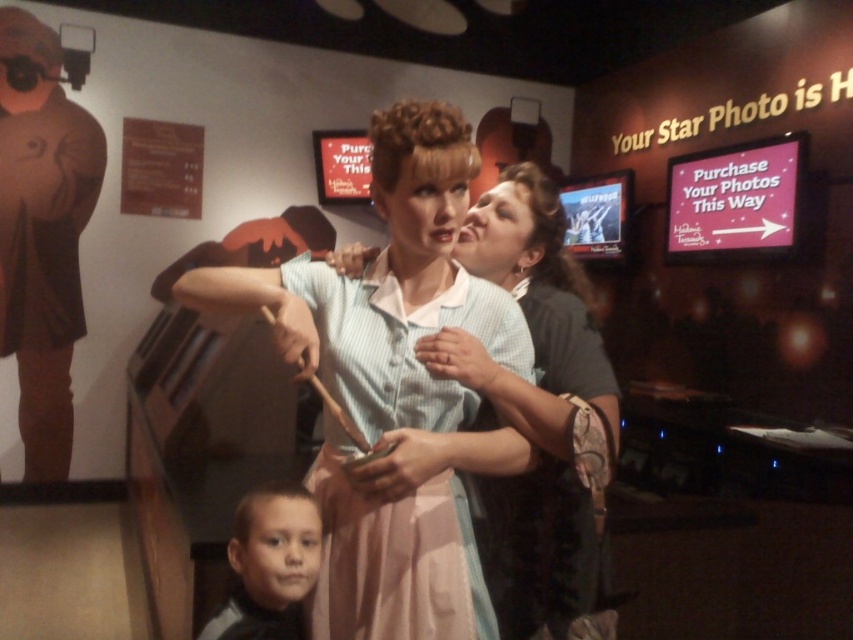
Question: Which point is closer to the camera taking this photo?

Choices:
 (A) (383, 401)
 (B) (270, 554)

Answer: (A)

Question: Does light blue fabric dress at center appear on the right side of smooth skin face at lower left?

Choices:
 (A) yes
 (B) no

Answer: (A)

Question: Does light blue fabric dress at center have a greater width compared to smooth skin face at lower left?

Choices:
 (A) no
 (B) yes

Answer: (B)

Question: Which of the following is the closest to the observer?

Choices:
 (A) light blue fabric dress at center
 (B) smooth skin face at lower left

Answer: (A)

Question: Is the position of light blue fabric dress at center less distant than that of smooth skin face at lower left?

Choices:
 (A) yes
 (B) no

Answer: (A)